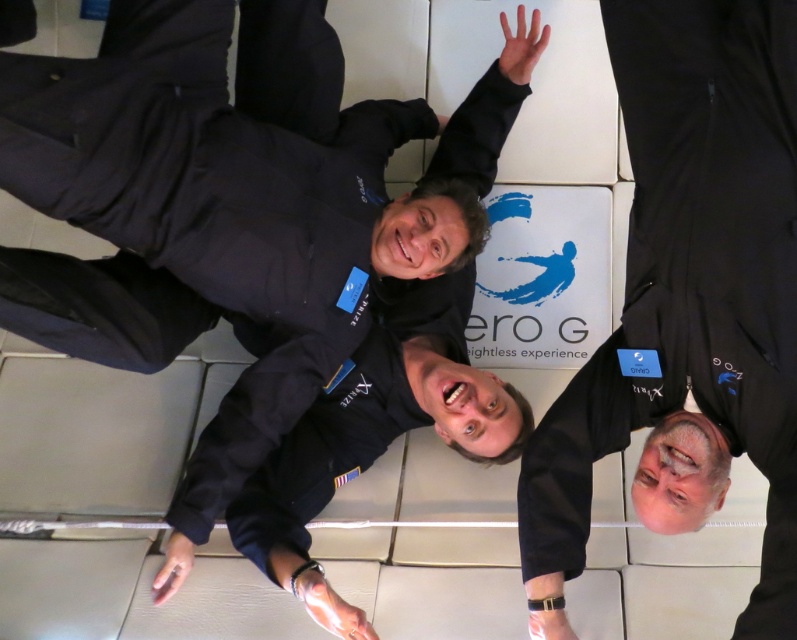
You are an astronaut preparing for a mission and need to determine the closest point to your current position. You observe two points in the scene labeled as point (x=32, y=300) and point (x=662, y=493). Which point is closer to you?

Point (x=32, y=300) is closer to you because it is further to the camera than point (x=662, y=493).

You are an astronaut preparing for a zero gravity mission. You see two team members wearing the matte black suit at upper center and the black matte jumpsuit at upper right. Which team member is positioned to your left when facing the direction of the Zero G logo on the wall?

The matte black suit at upper center is positioned on the left side of the black matte jumpsuit at upper right, so when facing the Zero G logo, the matte black suit at upper center would be to your left.

You are an astronaut preparing for a mission and need to identify the highest point in the image. Which object is located higher between the matte black suit at upper center and the black matte jumpsuit at upper right?

The matte black suit at upper center is positioned over the black matte jumpsuit at upper right, so it is higher.